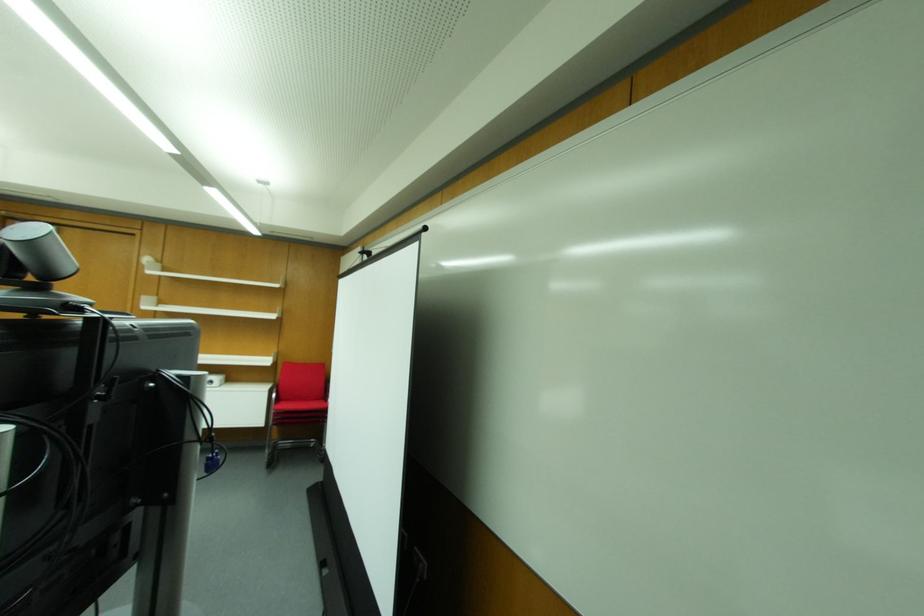
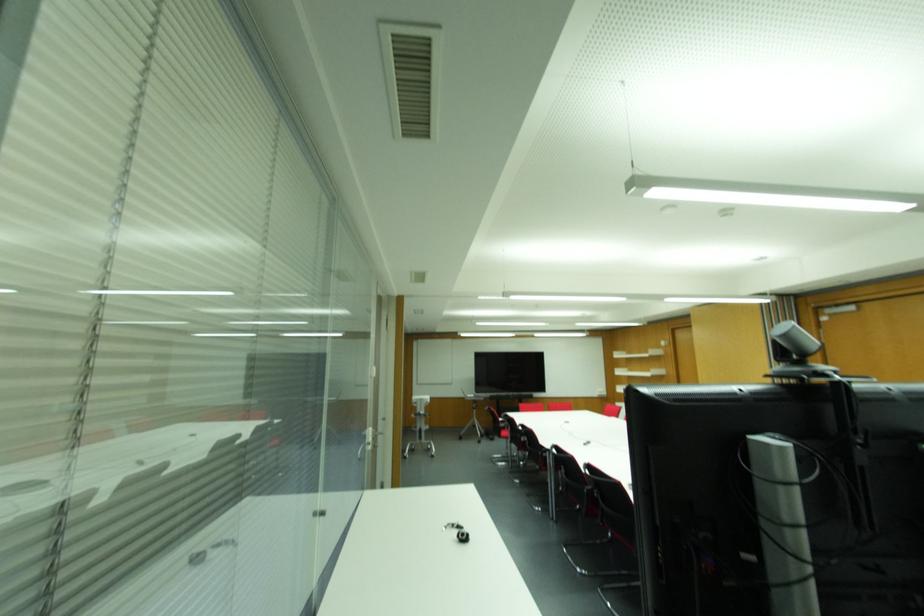
Question: The first image is from the beginning of the video and the second image is from the end. How did the camera likely rotate when shooting the video?

Choices:
 (A) Left
 (B) Right
 (C) Up
 (D) Down

Answer: (A)